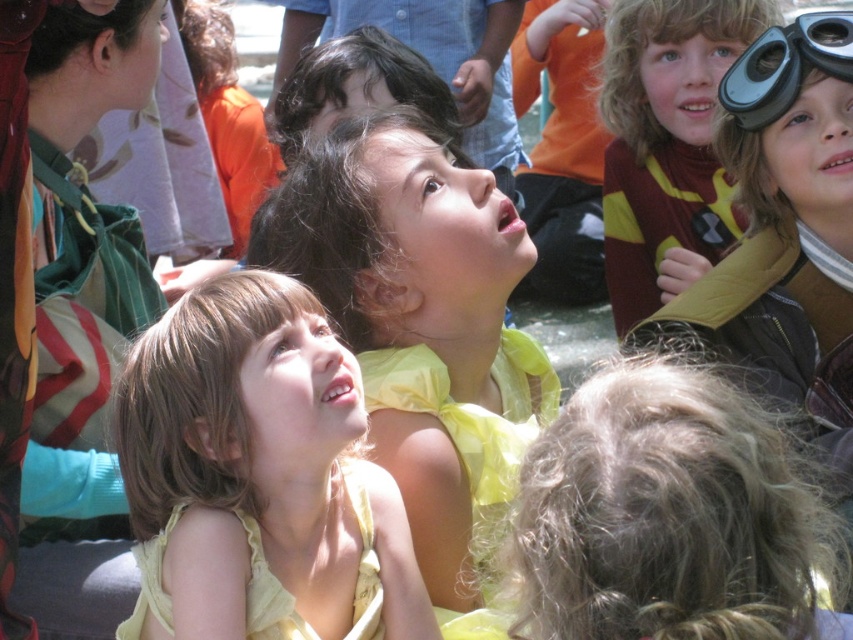
You are a photographer trying to capture a clear shot of the yellow satin dress at center and the matte brown sweater at upper right. Which object will appear larger in your photo?

The yellow satin dress at center will appear larger in the photo because it is closer to the viewer than the matte brown sweater at upper right.

You are taking a photo of two points in the scene. The first point is at coordinates point (218, 477) and the second point is at point (692, 74). Which point will appear larger in your photo?

Point (218, 477) is closer to the camera than point (692, 74), so it will appear larger in the photo.